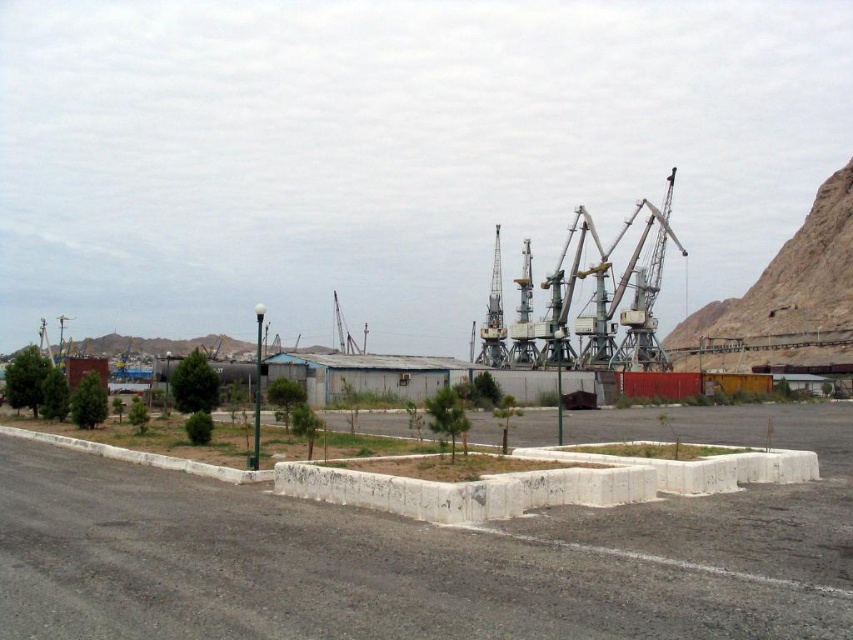
You are driving a delivery truck that is 1.2 meters tall. You need to pass under the concrete at center and the white concrete curb at center. Which one can your truck safely pass under without hitting the top?

The white concrete curb at center is shorter than the concrete at center, so the truck can safely pass under the white concrete curb at center since it is taller than 1.2 meters. However, the concrete at center is taller, so the truck cannot pass under it without hitting the top.

You are a delivery truck driver who needs to park your vehicle in the parking lot shown in the image. The parking space has a concrete at center and a white concrete curb at center. Which object should you avoid hitting when backing into the parking spot?

You should avoid hitting the white concrete curb at center because it is smaller in size compared to the concrete at center, making it more vulnerable to damage from the truck.